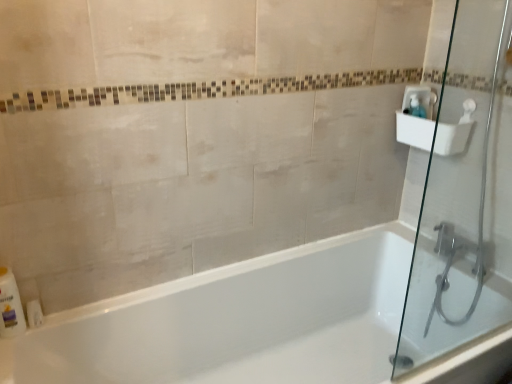
I want to click on white plastic bottle at lower left, so click(10, 306).

Measure the distance between point (419, 114) and camera.

Point (419, 114) is 1.74 meters from camera.

Identify the location of clear plastic soap dispenser at upper right. (415, 106).

Image resolution: width=512 pixels, height=384 pixels. What do you see at coordinates (460, 201) in the screenshot? I see `transparent glass shower door at right` at bounding box center [460, 201].

The image size is (512, 384). What are the coordinates of `white plastic bottle at lower left` in the screenshot? It's located at (10, 306).

Is clear plastic soap dispenser at upper right far from white plastic sink at upper right?

No, clear plastic soap dispenser at upper right is in close proximity to white plastic sink at upper right.

From the picture: Can white plastic sink at upper right be found inside clear plastic soap dispenser at upper right?

No.

From a real-world perspective, is clear plastic soap dispenser at upper right physically below white plastic sink at upper right?

No, from a real-world perspective, clear plastic soap dispenser at upper right is not below white plastic sink at upper right.

Is clear plastic soap dispenser at upper right oriented away from white plastic sink at upper right?

Yes, clear plastic soap dispenser at upper right is facing away from white plastic sink at upper right.

Considering the relative sizes of white glossy bathtub at center and white plastic sink at upper right in the image provided, is white glossy bathtub at center shorter than white plastic sink at upper right?

Incorrect, the height of white glossy bathtub at center does not fall short of that of white plastic sink at upper right.

From the image's perspective, is white glossy bathtub at center over white plastic sink at upper right?

No.

Based on the photo, is white glossy bathtub at center closer to the viewer compared to white plastic sink at upper right?

Yes, the depth of white glossy bathtub at center is less than that of white plastic sink at upper right.

From a real-world perspective, is white glossy bathtub at center positioned under white plastic sink at upper right based on gravity?

Correct, in the physical world, white glossy bathtub at center is lower than white plastic sink at upper right.

From the image's perspective, which one is positioned higher, white plastic bottle at lower left or clear plastic soap dispenser at upper right?

clear plastic soap dispenser at upper right, from the image's perspective.

Considering the points (12, 280) and (410, 106), which point is behind, point (12, 280) or point (410, 106)?

The point (410, 106) is farther.

From a real-world perspective, between white plastic bottle at lower left and clear plastic soap dispenser at upper right, who is vertically lower?

From a 3D spatial view, white plastic bottle at lower left is below.

In the scene shown: Can you confirm if white plastic bottle at lower left is wider than clear plastic soap dispenser at upper right?

Incorrect, the width of white plastic bottle at lower left does not surpass that of clear plastic soap dispenser at upper right.

Are transparent glass shower door at right and white plastic bottle at lower left far apart?

Yes, transparent glass shower door at right and white plastic bottle at lower left are located far from each other.

From a real-world perspective, is transparent glass shower door at right on white plastic bottle at lower left?

Yes.

In terms of width, does transparent glass shower door at right look wider or thinner when compared to white plastic bottle at lower left?

transparent glass shower door at right is wider than white plastic bottle at lower left.

Is transparent glass shower door at right looking in the opposite direction of white plastic bottle at lower left?

No.

Considering the sizes of objects white plastic sink at upper right and clear plastic soap dispenser at upper right in the image provided, who is thinner, white plastic sink at upper right or clear plastic soap dispenser at upper right?

clear plastic soap dispenser at upper right.

Would you say white plastic sink at upper right is inside or outside clear plastic soap dispenser at upper right?

white plastic sink at upper right is not enclosed by clear plastic soap dispenser at upper right.

Is white plastic sink at upper right oriented towards clear plastic soap dispenser at upper right?

Yes, white plastic sink at upper right is oriented towards clear plastic soap dispenser at upper right.

Considering the sizes of white plastic sink at upper right and clear plastic soap dispenser at upper right in the image, is white plastic sink at upper right taller or shorter than clear plastic soap dispenser at upper right?

Clearly, white plastic sink at upper right is taller compared to clear plastic soap dispenser at upper right.

From the image's perspective, is transparent glass shower door at right above white glossy bathtub at center?

Yes, from the image's perspective, transparent glass shower door at right is above white glossy bathtub at center.

Is the surface of transparent glass shower door at right in direct contact with white glossy bathtub at center?

transparent glass shower door at right and white glossy bathtub at center are not in contact.

From a real-world perspective, which object rests below the other?

From a 3D spatial view, white glossy bathtub at center is below.

Is transparent glass shower door at right looking in the opposite direction of white glossy bathtub at center?

No, transparent glass shower door at right's orientation is not away from white glossy bathtub at center.

Considering the relative sizes of white glossy bathtub at center and white plastic bottle at lower left in the image provided, is white glossy bathtub at center wider than white plastic bottle at lower left?

Correct, the width of white glossy bathtub at center exceeds that of white plastic bottle at lower left.

Is white plastic bottle at lower left located within white glossy bathtub at center?

Yes, white plastic bottle at lower left is inside white glossy bathtub at center.

Is white glossy bathtub at center facing towards white plastic bottle at lower left?

No, white glossy bathtub at center is not oriented towards white plastic bottle at lower left.

Which of these two, white glossy bathtub at center or white plastic bottle at lower left, stands shorter?

Standing shorter between the two is white plastic bottle at lower left.

Locate an element on the screen. soap dispenser that appears on the left of white plastic sink at upper right is located at coordinates (415, 106).

Locate an element on the screen. bathtub in front of the white plastic sink at upper right is located at coordinates (237, 322).

Considering their positions, is white plastic bottle at lower left positioned closer to white glossy bathtub at center than transparent glass shower door at right?

The object closer to white glossy bathtub at center is transparent glass shower door at right.

In the scene shown: When comparing their distances from transparent glass shower door at right, does white plastic bottle at lower left or white plastic sink at upper right seem closer?

white plastic sink at upper right.

Consider the image. Considering their positions, is clear plastic soap dispenser at upper right positioned further to white plastic sink at upper right than transparent glass shower door at right?

transparent glass shower door at right.

Estimate the real-world distances between objects in this image. Which object is further from clear plastic soap dispenser at upper right, white plastic sink at upper right or white glossy bathtub at center?

white glossy bathtub at center lies further to clear plastic soap dispenser at upper right than the other object.

Considering their positions, is clear plastic soap dispenser at upper right positioned further to white plastic sink at upper right than white plastic bottle at lower left?

Among the two, white plastic bottle at lower left is located further to white plastic sink at upper right.

Estimate the real-world distances between objects in this image. Which object is further from transparent glass shower door at right, white plastic bottle at lower left or clear plastic soap dispenser at upper right?

Based on the image, white plastic bottle at lower left appears to be further to transparent glass shower door at right.

Which object lies nearer to the anchor point transparent glass shower door at right, white plastic bottle at lower left or white glossy bathtub at center?

white glossy bathtub at center.

Based on their spatial positions, is white glossy bathtub at center or clear plastic soap dispenser at upper right closer to transparent glass shower door at right?

clear plastic soap dispenser at upper right is positioned closer to the anchor transparent glass shower door at right.

Find the location of a particular element. Image resolution: width=512 pixels, height=384 pixels. sink between white glossy bathtub at center and clear plastic soap dispenser at upper right from front to back is located at coordinates (416, 118).

The height and width of the screenshot is (384, 512). I want to click on shower door positioned between white glossy bathtub at center and clear plastic soap dispenser at upper right from near to far, so click(460, 201).

Image resolution: width=512 pixels, height=384 pixels. I want to click on bathtub situated between white plastic bottle at lower left and clear plastic soap dispenser at upper right from left to right, so click(x=237, y=322).

Identify the location of bathtub between white plastic bottle at lower left and transparent glass shower door at right. The width and height of the screenshot is (512, 384). (237, 322).